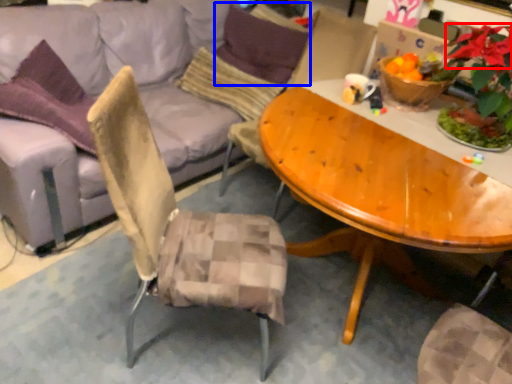
Question: Which object appears farthest to the camera in this image, flower (highlighted by a red box) or pillow (highlighted by a blue box)?

Choices:
 (A) flower
 (B) pillow

Answer: (B)